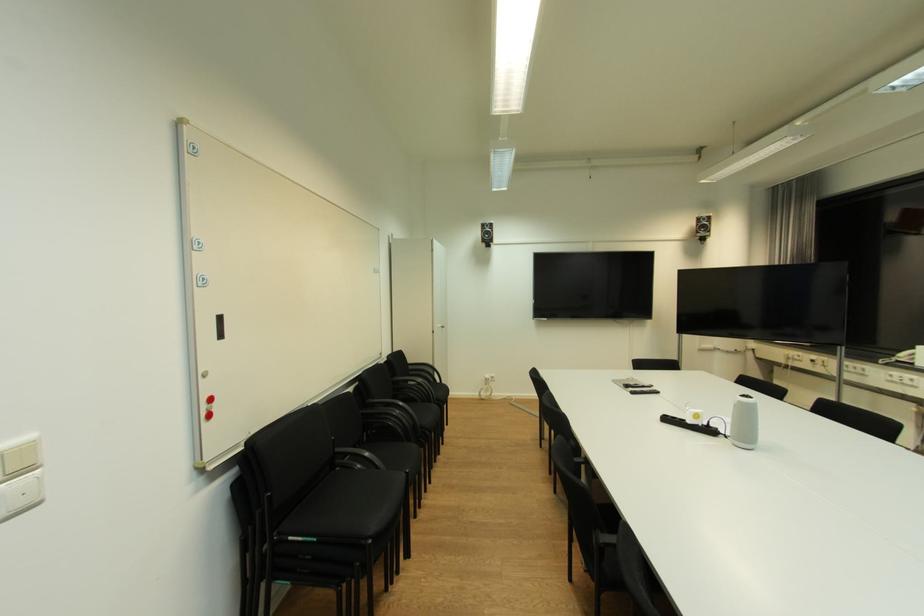
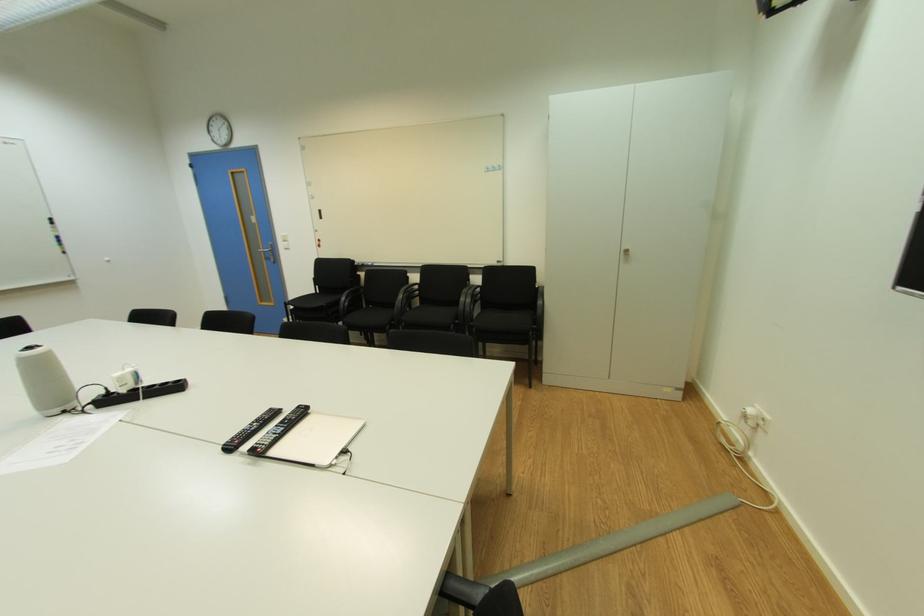
In the second image, find the point that corresponds to the point at 446,329 in the first image.

(628, 254)